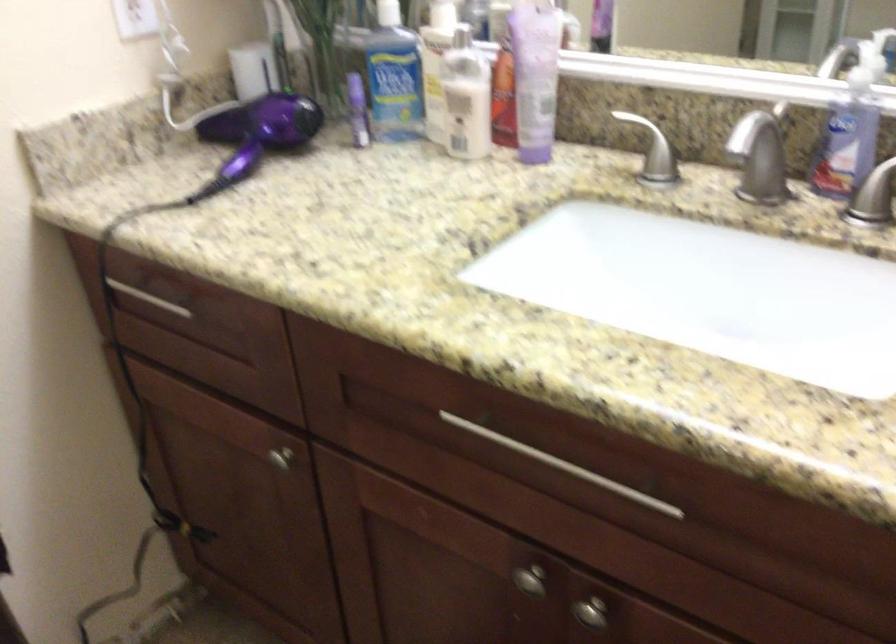
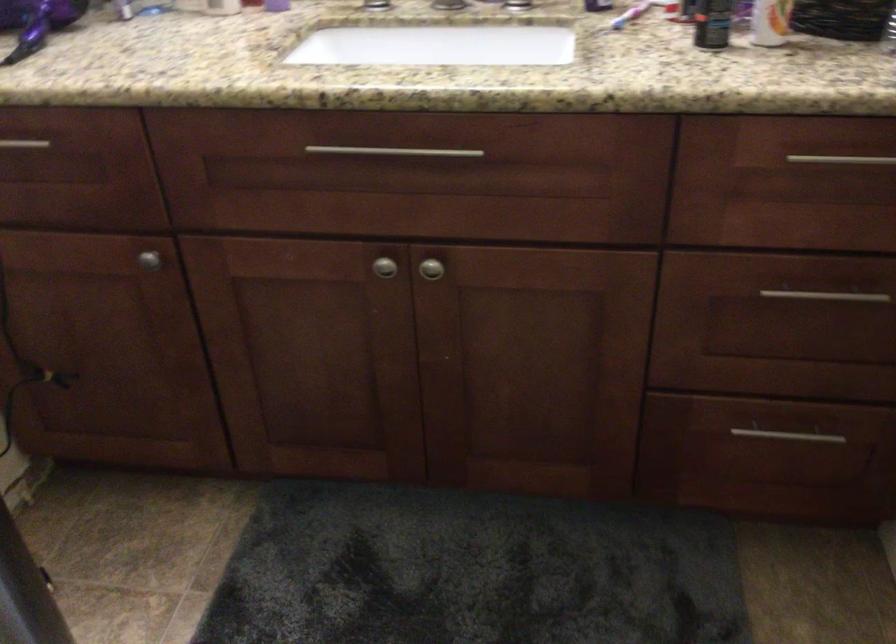
Question: I am providing you with two images of the same scene from different viewpoints. Which of the following objects are not visible in image2?

Choices:
 (A) silver cabinet knob
 (B) purple hair dryer
 (C) orange and white bottle
 (D) none of these

Answer: (D)